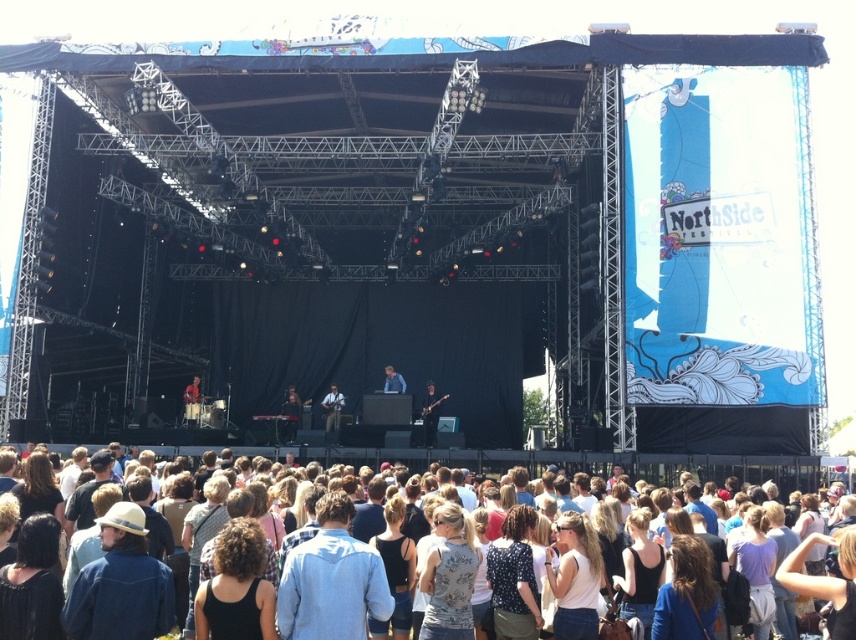
Does blue denim shirt at center have a greater height compared to metallic guitar at center?

Yes, blue denim shirt at center is taller than metallic guitar at center.

Can you confirm if blue denim shirt at center is positioned to the right of metallic guitar at center?

Correct, you'll find blue denim shirt at center to the right of metallic guitar at center.

Does point (337, 522) lie in front of point (331, 381)?

Yes, point (337, 522) is in front of point (331, 381).

The image size is (856, 640). In order to click on blue denim shirt at center in this screenshot , I will do `click(331, 579)`.

Between point (432, 419) and point (394, 387), which one is positioned behind?

Point (394, 387)

Does matte black guitar at center have a larger size compared to light brown leather guitar at center?

Yes.

Where is `matte black guitar at center`? matte black guitar at center is located at coordinates (431, 413).

Looking at this image, is blue denim shirt at center to the left of matte black drum set at center from the viewer's perspective?

No, blue denim shirt at center is not to the left of matte black drum set at center.

Does point (301, 614) lie in front of point (191, 406)?

That is True.

This screenshot has width=856, height=640. What are the coordinates of `blue denim shirt at center` in the screenshot? It's located at (331, 579).

At what (x,y) coordinates should I click in order to perform the action: click on blue denim shirt at center. Please return your answer as a coordinate pair (x, y). Image resolution: width=856 pixels, height=640 pixels. Looking at the image, I should click on (331, 579).